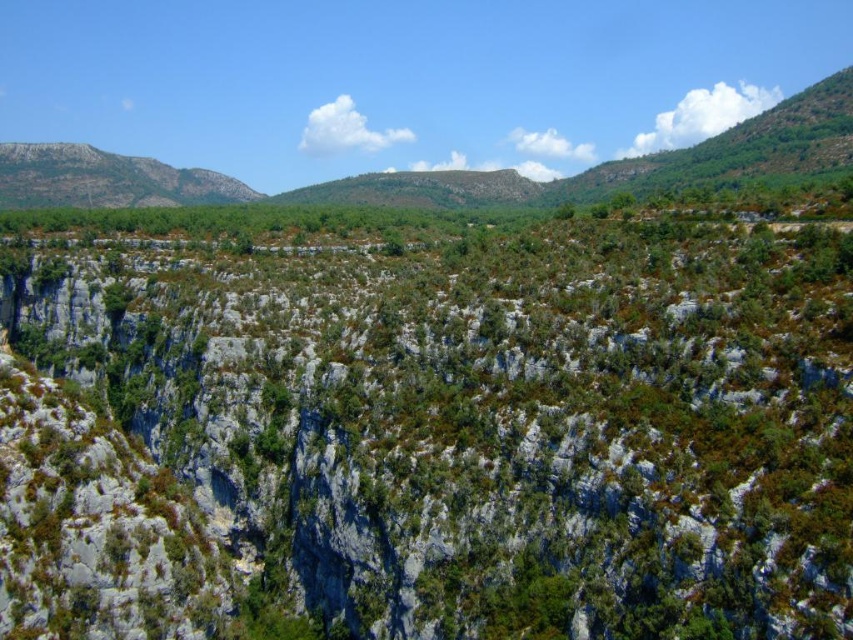
Between green leafy shrub at center and gray rocky mountain at upper left, which one is positioned higher?

gray rocky mountain at upper left is above.

Measure the distance between green leafy shrub at center and camera.

They are 47.44 meters apart.

Image resolution: width=853 pixels, height=640 pixels. Identify the location of green leafy shrub at center. (483, 408).